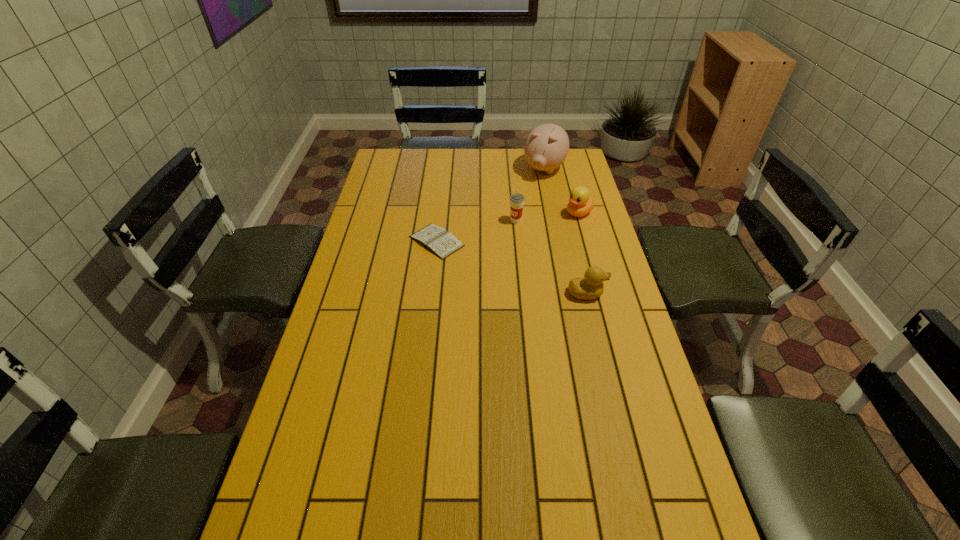
Image resolution: width=960 pixels, height=540 pixels. What are the coordinates of `vacant space situated on the side of the second object from left to right with the logo` in the screenshot? It's located at (475, 284).

I want to click on vacant space located 0.310m on the side of the second object from left to right with the logo, so click(x=479, y=278).

This screenshot has width=960, height=540. Identify the location of free space located 0.050m on the face of the farther duckling. (562, 224).

You are a GUI agent. You are given a task and a screenshot of the screen. Output one action in this format:
    pyautogui.click(x=<x>, y=<y>)
    Task: Click on the vacant area located 0.310m on the face of the farther duckling
    The width and height of the screenshot is (960, 540).
    Given the screenshot: What is the action you would take?
    pyautogui.click(x=515, y=255)

The height and width of the screenshot is (540, 960). I want to click on vacant space situated on the face of the farther duckling, so click(x=550, y=232).

You are a GUI agent. You are given a task and a screenshot of the screen. Output one action in this format:
    pyautogui.click(x=<x>, y=<y>)
    Task: Click on the free spot located at the snout of the tallest object
    This screenshot has height=540, width=960.
    Given the screenshot: What is the action you would take?
    pyautogui.click(x=519, y=211)

Identify the location of free space located at the snout of the tallest object. click(x=534, y=189).

At what (x,y) coordinates should I click in order to perform the action: click on blank space located 0.240m at the snout of the tallest object. Please return your answer as a coordinate pair (x, y). Looking at the image, I should click on (517, 214).

What are the coordinates of `object at the far edge` in the screenshot? It's located at (546, 147).

You are a GUI agent. You are given a task and a screenshot of the screen. Output one action in this format:
    pyautogui.click(x=<x>, y=<y>)
    Task: Click on the piggy bank present at the right edge
    This screenshot has height=540, width=960.
    Given the screenshot: What is the action you would take?
    pyautogui.click(x=546, y=147)